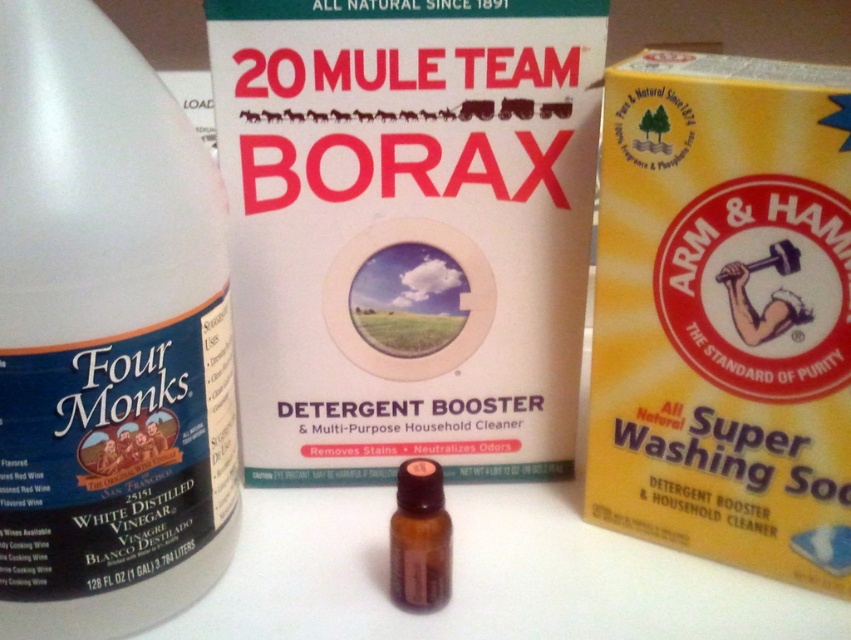
You are a photographer setting up a shot of the cleaning products. You need to position the white matte box at center so that it is exactly 30 inches away from the camera lens. Currently, it is 29.37 inches away. Should you move it closer or farther away?

The white matte box at center is currently 29.37 inches away from the camera. To reach the desired 30 inches, you should move it slightly farther away from the camera.